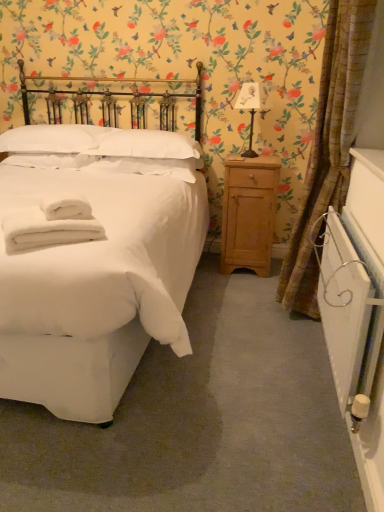
Question: In the image, is white paper lampshade at upper right positioned in front of or behind white soft pillow at upper center, the 1th pillow positioned from the right?

Choices:
 (A) front
 (B) behind

Answer: (B)

Question: Which is correct: white paper lampshade at upper right is inside white soft pillow at upper center, the 1th pillow positioned from the right, or outside of it?

Choices:
 (A) inside
 (B) outside

Answer: (B)

Question: Which is nearer to the white soft towel at lower left?

Choices:
 (A) white cotton bed at left
 (B) light wood/roughnightstand at right
 (C) white soft pillow at upper left, the second pillow when ordered from right to left
 (D) textured beige curtain at right
 (E) white paper lampshade at upper right

Answer: (A)

Question: Which object is the closest to the white paper lampshade at upper right?

Choices:
 (A) light wood/roughnightstand at right
 (B) white soft pillow at upper center, which is the second pillow in left-to-right order
 (C) textured beige curtain at right
 (D) white soft pillow at upper left, the second pillow when ordered from right to left
 (E) white soft towel at lower left

Answer: (A)